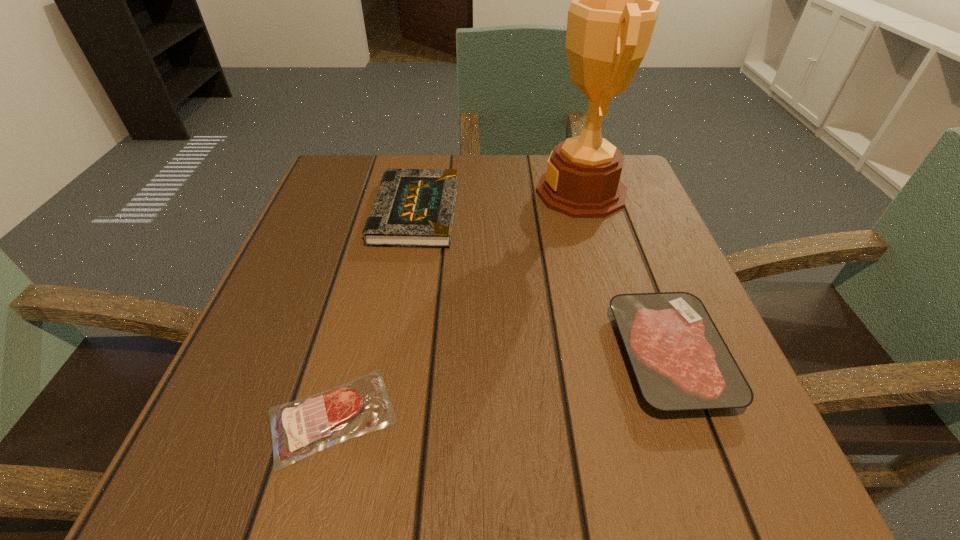
Find the location of a particular element. The height and width of the screenshot is (540, 960). object at the near left corner is located at coordinates (300, 428).

You are a GUI agent. You are given a task and a screenshot of the screen. Output one action in this format:
    pyautogui.click(x=<x>, y=<y>)
    Task: Click on the object at the far right corner
    
    Given the screenshot: What is the action you would take?
    pyautogui.click(x=611, y=19)

In the image, there is a desktop. Identify the location of vacant space at the far edge. (539, 172).

Image resolution: width=960 pixels, height=540 pixels. Find the location of `vacant space at the near edge of the desktop`. vacant space at the near edge of the desktop is located at coordinates (436, 496).

Image resolution: width=960 pixels, height=540 pixels. In order to click on vacant space at the left edge of the desktop in this screenshot , I will do `click(285, 349)`.

Identify the location of blank space at the right edge of the desktop. (600, 277).

Identify the location of free point at the far left corner. The image size is (960, 540). (335, 192).

In the image, there is a desktop. Where is `vacant space at the near left corner`? The height and width of the screenshot is (540, 960). vacant space at the near left corner is located at coordinates (252, 444).

In the image, there is a desktop. In order to click on free region at the far right corner in this screenshot , I will do `click(636, 192)`.

Locate an element on the screen. The image size is (960, 540). vacant space at the near right corner of the desktop is located at coordinates (658, 490).